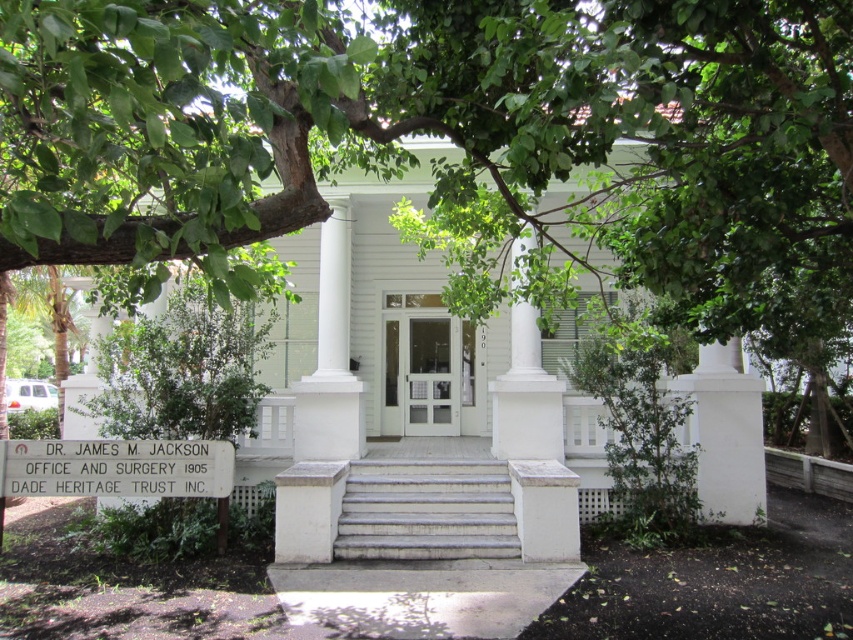
Question: Can you confirm if white marble stairs at center is positioned below white smooth column at center?

Choices:
 (A) yes
 (B) no

Answer: (A)

Question: Does white marble stairs at center have a smaller size compared to white smooth column at center?

Choices:
 (A) yes
 (B) no

Answer: (A)

Question: Which point is farther to the camera?

Choices:
 (A) (494, 520)
 (B) (334, 460)

Answer: (B)

Question: Observing the image, what is the correct spatial positioning of white marble stairs at center in reference to white smooth column at center?

Choices:
 (A) left
 (B) right

Answer: (B)